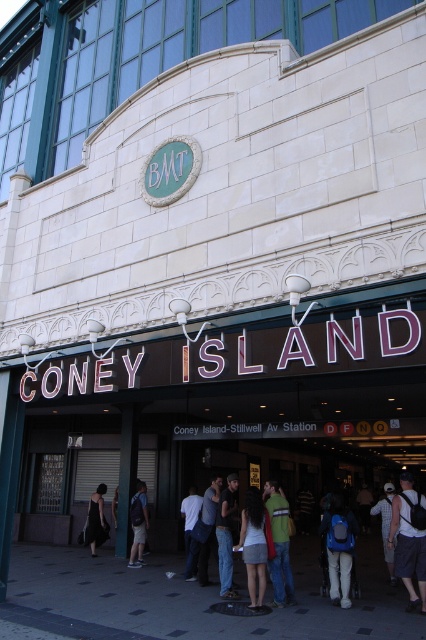
Is denim shorts at center to the right of dark blue jeans at center from the viewer's perspective?

Correct, you'll find denim shorts at center to the right of dark blue jeans at center.

Is denim shorts at center below dark blue jeans at center?

Incorrect, denim shorts at center is not positioned below dark blue jeans at center.

Between point (416, 608) and point (199, 561), which one is positioned in front?

Point (416, 608)

You are a GUI agent. You are given a task and a screenshot of the screen. Output one action in this format:
    pyautogui.click(x=<x>, y=<y>)
    Task: Click on the denim shorts at center
    Image resolution: width=426 pixels, height=640 pixels.
    Given the screenshot: What is the action you would take?
    pyautogui.click(x=408, y=541)

How much distance is there between denim jeans at center and light blue denim jeans at center?

denim jeans at center and light blue denim jeans at center are 1.33 meters apart from each other.

At what (x,y) coordinates should I click in order to perform the action: click on denim jeans at center. Please return your answer as a coordinate pair (x, y). The width and height of the screenshot is (426, 640). Looking at the image, I should click on (226, 536).

Is point (232, 500) closer to camera compared to point (192, 484)?

Yes, point (232, 500) is closer to viewer.

The image size is (426, 640). Identify the location of denim jeans at center. (226, 536).

The image size is (426, 640). What do you see at coordinates (253, 545) in the screenshot? I see `light gray denim shorts at center` at bounding box center [253, 545].

Between light gray denim shorts at center and khaki shorts at center, which one appears on the right side from the viewer's perspective?

light gray denim shorts at center

Image resolution: width=426 pixels, height=640 pixels. I want to click on light gray denim shorts at center, so (x=253, y=545).

Identify the location of light gray denim shorts at center. (253, 545).